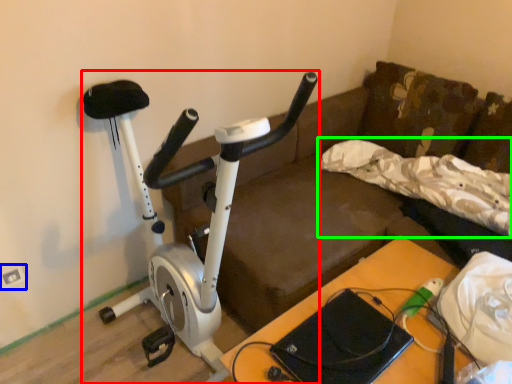
Question: Considering the real-world distances, which object is closest to stationary bicycle (highlighted by a red box)? electric outlet (highlighted by a blue box) or pillow (highlighted by a green box).

Choices:
 (A) electric outlet
 (B) pillow

Answer: (A)